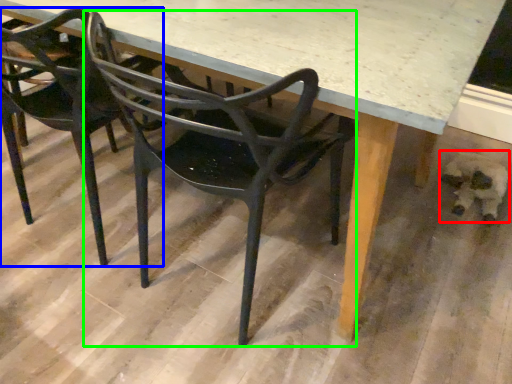
Question: Estimate the real-world distances between objects in this image. Which object is farther from animal (highlighted by a red box), chair (highlighted by a blue box) or chair (highlighted by a green box)?

Choices:
 (A) chair
 (B) chair

Answer: (A)